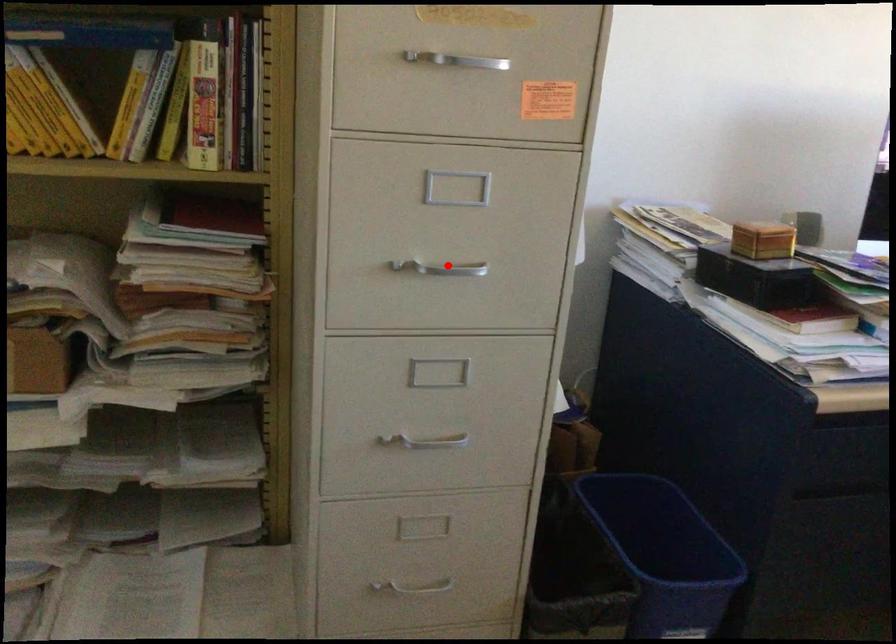
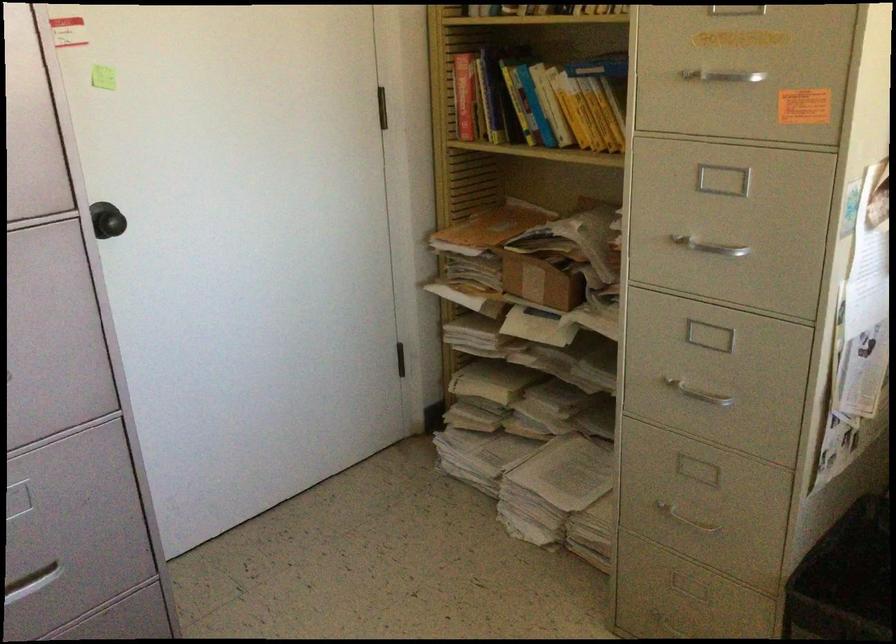
Question: A red point is marked in image1. In image2, is the corresponding 3D point closer to the camera or farther? Reply with the corresponding letter.

Choices:
 (A) The corresponding 3D point is closer.
 (B) The corresponding 3D point is farther.

Answer: (B)